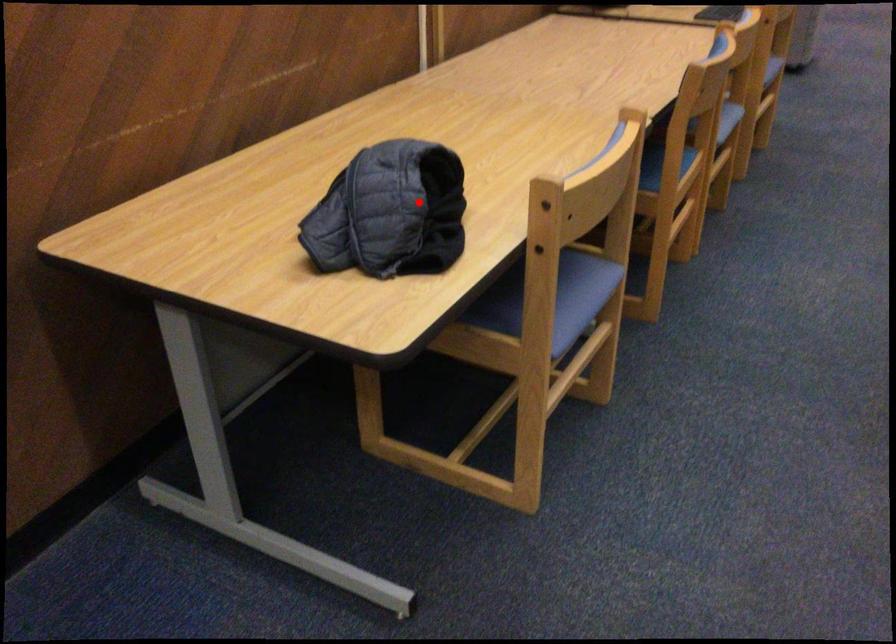
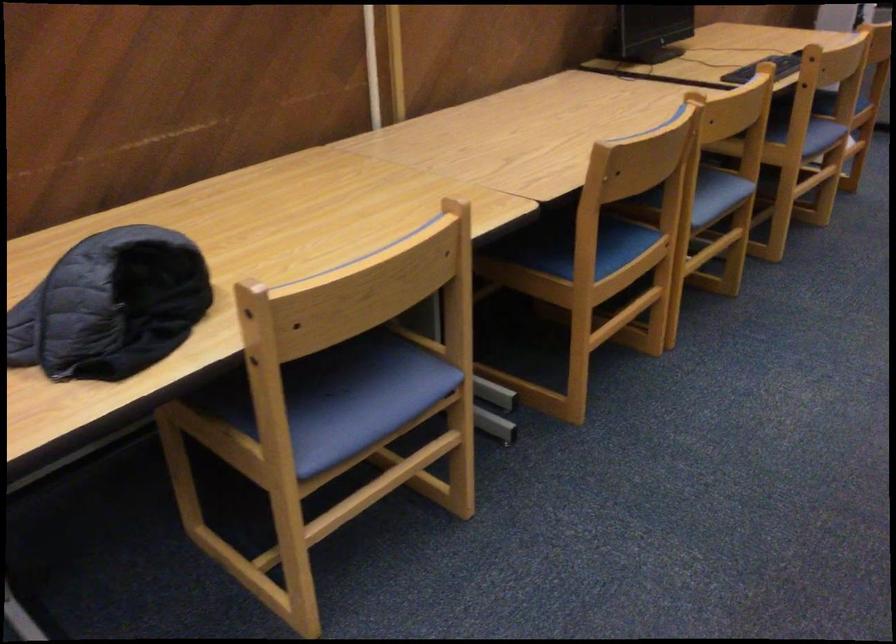
Locate, in the second image, the point that corresponds to the highlighted location in the first image.

(110, 305)